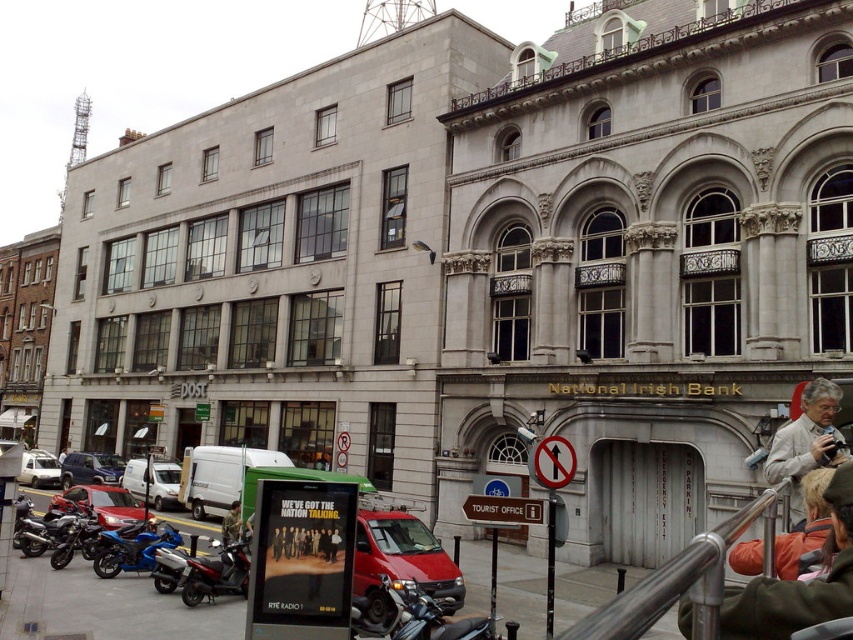
Who is shorter, metallic silver scooter at lower center or blue metallic motorcycle at lower left?

Standing shorter between the two is blue metallic motorcycle at lower left.

Consider the image. Is metallic silver scooter at lower center smaller than blue metallic motorcycle at lower left?

Incorrect, metallic silver scooter at lower center is not smaller in size than blue metallic motorcycle at lower left.

Does point (415, 621) lie behind point (109, 573)?

No, (415, 621) is in front of (109, 573).

Locate an element on the screen. The width and height of the screenshot is (853, 640). metallic silver scooter at lower center is located at coordinates (415, 616).

From the picture: Is metallic silver scooter at lower center closer to the viewer compared to metallic silver sign at center?

Yes, it is.

Which is in front, point (451, 627) or point (532, 513)?

Point (451, 627) is more forward.

The image size is (853, 640). In order to click on metallic silver scooter at lower center in this screenshot , I will do `click(415, 616)`.

Can you confirm if light beige fabric jacket at right is positioned above metallic silver sign at center?

Correct, light beige fabric jacket at right is located above metallic silver sign at center.

Does light beige fabric jacket at right have a greater width compared to metallic silver sign at center?

Yes.

Is point (798, 454) less distant than point (540, 509)?

Yes, it is in front of point (540, 509).

Locate an element on the screen. light beige fabric jacket at right is located at coordinates (805, 440).